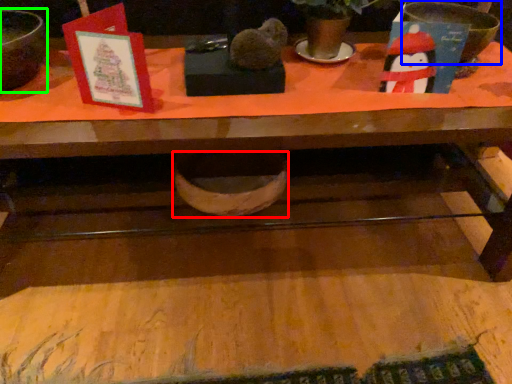
Question: Which object is positioned closest to basin (highlighted by a red box)? Select from basin (highlighted by a blue box) and mixing bowl (highlighted by a green box).

Choices:
 (A) basin
 (B) mixing bowl

Answer: (B)